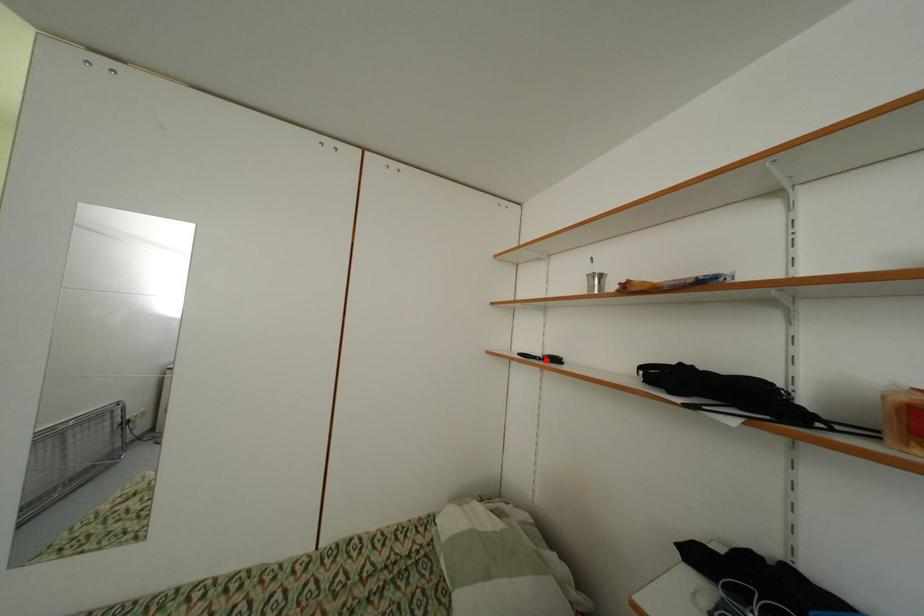
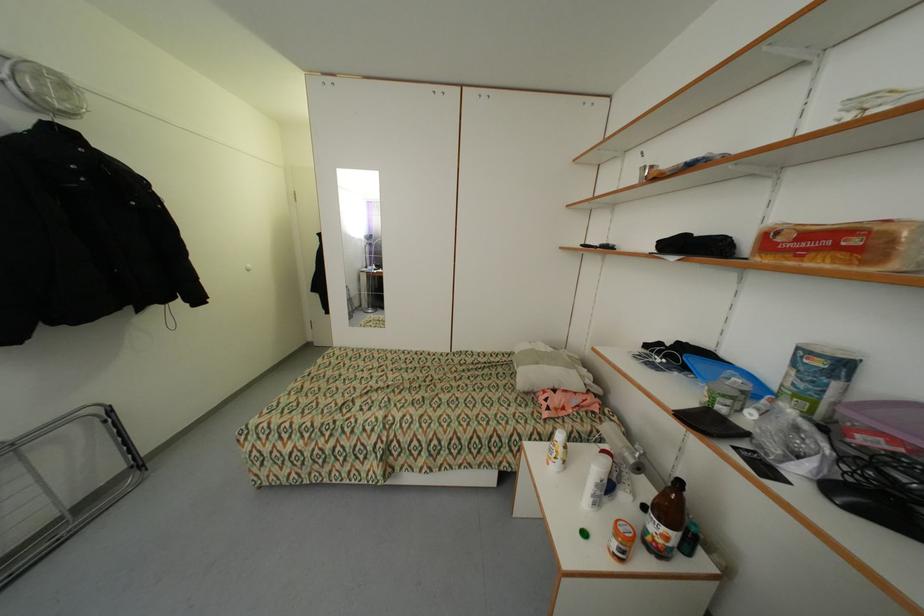
In the second image, find the point that corresponds to the highlighted location in the first image.

(602, 248)